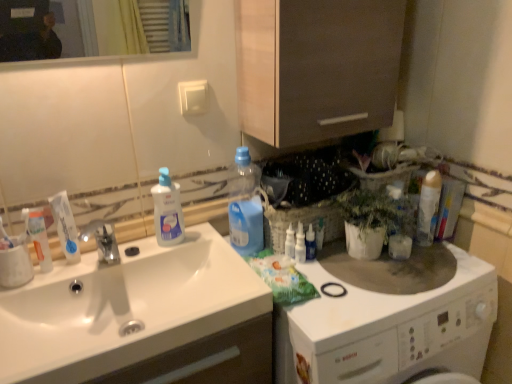
Where is `free spot to the right of translucent plastic bottles at upper right, positioned as the fourth toiletry in front-to-back order`? This screenshot has width=512, height=384. free spot to the right of translucent plastic bottles at upper right, positioned as the fourth toiletry in front-to-back order is located at coordinates (373, 259).